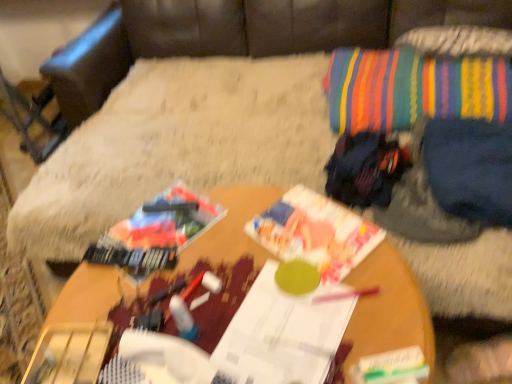
Question: Does white paper magazine at center, positioned as the 1th magazine in bottom-to-top order, have a lesser height compared to multicolored fabric bean bag chair at upper right?

Choices:
 (A) yes
 (B) no

Answer: (A)

Question: Is white paper magazine at center, arranged as the second magazine when viewed from the top, smaller than multicolored fabric bean bag chair at upper right?

Choices:
 (A) no
 (B) yes

Answer: (B)

Question: Does white paper magazine at center, arranged as the second magazine when viewed from the top, appear on the right side of multicolored fabric bean bag chair at upper right?

Choices:
 (A) yes
 (B) no

Answer: (B)

Question: From the image's perspective, is white paper magazine at center, positioned as the 1th magazine in bottom-to-top order, below multicolored fabric bean bag chair at upper right?

Choices:
 (A) yes
 (B) no

Answer: (A)

Question: Does white paper magazine at center, arranged as the second magazine when viewed from the top, contain multicolored fabric bean bag chair at upper right?

Choices:
 (A) no
 (B) yes

Answer: (A)

Question: Does point (331, 125) appear closer or farther from the camera than point (123, 296)?

Choices:
 (A) farther
 (B) closer

Answer: (A)

Question: From their relative heights in the image, would you say striped fabric throw pillow at upper right is taller or shorter than wooden table at center?

Choices:
 (A) short
 (B) tall

Answer: (A)

Question: In terms of width, does striped fabric throw pillow at upper right look wider or thinner when compared to wooden table at center?

Choices:
 (A) thin
 (B) wide

Answer: (A)

Question: Is striped fabric throw pillow at upper right inside or outside of wooden table at center?

Choices:
 (A) inside
 (B) outside

Answer: (B)

Question: Is point 174,51 positioned closer to the camera than point 420,105?

Choices:
 (A) farther
 (B) closer

Answer: (A)

Question: Considering the relative positions of multicolored fabric bean bag chair at upper right and striped fabric throw pillow at upper right in the image provided, is multicolored fabric bean bag chair at upper right to the left or to the right of striped fabric throw pillow at upper right?

Choices:
 (A) right
 (B) left

Answer: (B)

Question: Is multicolored fabric bean bag chair at upper right in front of or behind striped fabric throw pillow at upper right in the image?

Choices:
 (A) front
 (B) behind

Answer: (A)

Question: Is multicolored fabric bean bag chair at upper right wider or thinner than striped fabric throw pillow at upper right?

Choices:
 (A) thin
 (B) wide

Answer: (B)

Question: Considering the positions of multicolored fabric bean bag chair at upper right and wooden table at center in the image, is multicolored fabric bean bag chair at upper right bigger or smaller than wooden table at center?

Choices:
 (A) big
 (B) small

Answer: (A)

Question: Relative to wooden table at center, is multicolored fabric bean bag chair at upper right in front or behind?

Choices:
 (A) behind
 (B) front

Answer: (A)